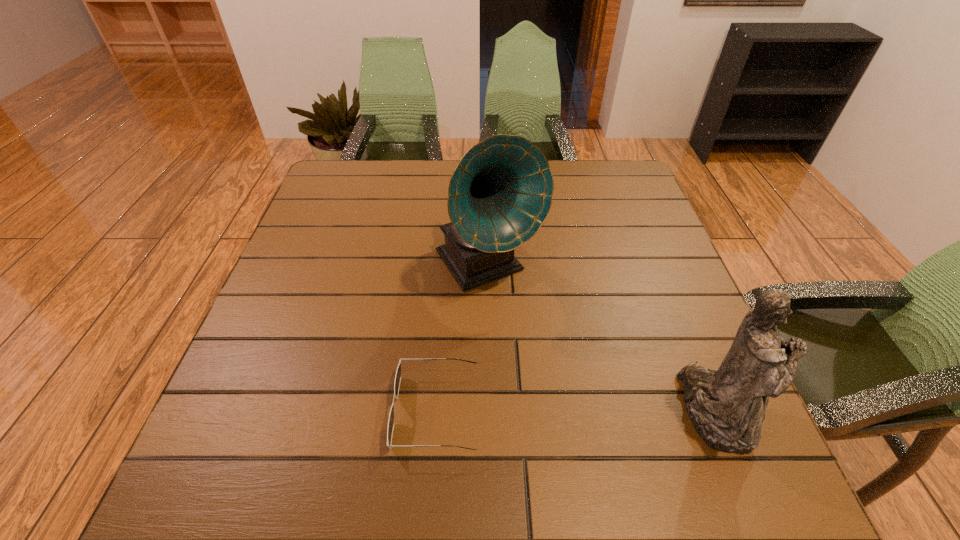
Locate an element on the screen. This screenshot has height=540, width=960. free space located 0.070m from the horn of the phonograph_record is located at coordinates (530, 326).

The width and height of the screenshot is (960, 540). Find the location of `sunglasses present at the near edge`. sunglasses present at the near edge is located at coordinates (398, 373).

Find the location of a particular element. This screenshot has height=540, width=960. figurine located in the near edge section of the desktop is located at coordinates (727, 406).

The image size is (960, 540). Find the location of `object that is positioned at the right edge`. object that is positioned at the right edge is located at coordinates (727, 406).

Where is `object that is at the near right corner`? object that is at the near right corner is located at coordinates (727, 406).

At what (x,y) coordinates should I click in order to perform the action: click on free space at the far edge. Please return your answer as a coordinate pair (x, y). This screenshot has height=540, width=960. Looking at the image, I should click on (386, 202).

In the image, there is a desktop. Where is `free space at the near edge`? free space at the near edge is located at coordinates (524, 408).

Find the location of `vacant space at the left edge of the desktop`. vacant space at the left edge of the desktop is located at coordinates (246, 367).

You are a GUI agent. You are given a task and a screenshot of the screen. Output one action in this format:
    pyautogui.click(x=<x>, y=<y>)
    Task: Click on the vacant space at the right edge of the desktop
    
    Given the screenshot: What is the action you would take?
    pyautogui.click(x=715, y=368)

Identify the location of vacant area at the far left corner of the desktop. (350, 166).